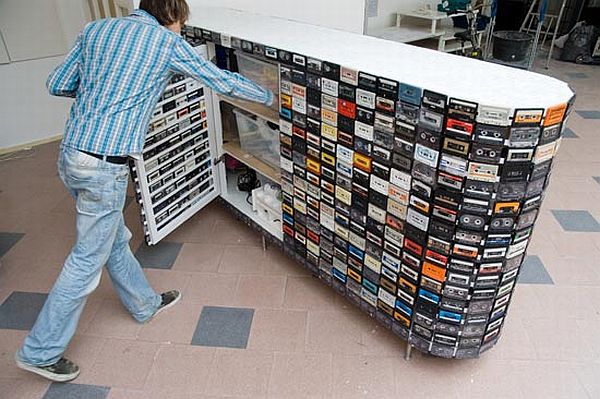
Locate an element on the screen. The image size is (600, 399). tan tile is located at coordinates (304, 373).